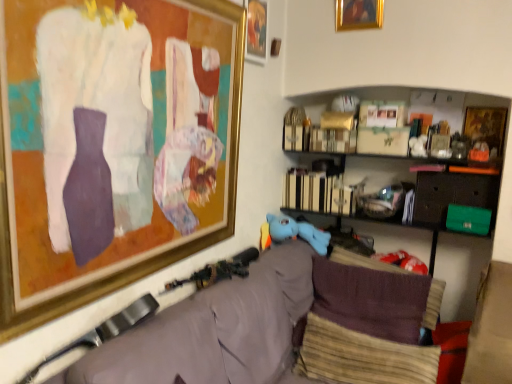
Question: Does point (266, 26) appear closer or farther from the camera than point (394, 309)?

Choices:
 (A) closer
 (B) farther

Answer: (B)

Question: In terms of width, does gold-framed picture at upper center, which ranks as the third picture frame in right-to-left order, look wider or thinner when compared to woolen fabric pillow at center, which ranks as the 2th pillow in front-to-back order?

Choices:
 (A) thin
 (B) wide

Answer: (A)

Question: Estimate the real-world distances between objects in this image. Which object is closer to the gold-framed picture at upper center, which ranks as the third picture frame in right-to-left order?

Choices:
 (A) wooden framed picture at upper right, the fourth picture frame viewed from the left
 (B) beige textured pillow at lower right, placed as the first pillow when sorted from front to back
 (C) matte brown cushion at lower right
 (D) velvet grey couch at lower center
 (E) woolen fabric pillow at center, which ranks as the 2th pillow in front-to-back order

Answer: (A)

Question: Which is farther from the velvet grey couch at lower center?

Choices:
 (A) beige textured pillow at lower right, the 2th pillow positioned from the back
 (B) gold-framed painting at upper center, the second picture frame viewed from the right
 (C) gold-framed picture at upper center, which ranks as the third picture frame in right-to-left order
 (D) matte brown cushion at lower right
 (E) wooden framed picture at upper right, the first picture frame from the right

Answer: (B)